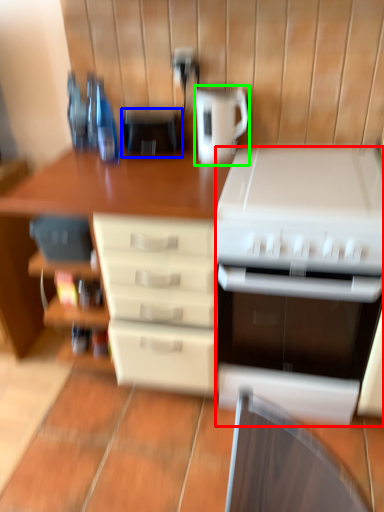
Question: Considering the real-world distances, which object is farthest from kitchen appliance (highlighted by a red box)? appliance (highlighted by a blue box) or kitchen appliance (highlighted by a green box)?

Choices:
 (A) appliance
 (B) kitchen appliance

Answer: (A)